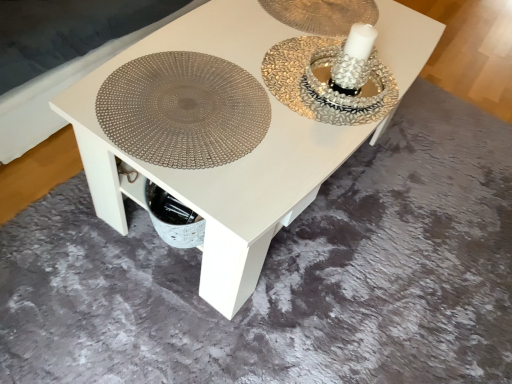
What do you see at coordinates (183, 110) in the screenshot? I see `matte silver platter at center` at bounding box center [183, 110].

At what (x,y) coordinates should I click in order to perform the action: click on matte silver platter at center. Please return your answer as a coordinate pair (x, y). Looking at the image, I should click on (183, 110).

Measure the distance between white glossy table at center and camera.

white glossy table at center and camera are 81.70 centimeters apart from each other.

Find the location of a particular element. white glossy table at center is located at coordinates (225, 165).

This screenshot has width=512, height=384. What do you see at coordinates (225, 165) in the screenshot? I see `white glossy table at center` at bounding box center [225, 165].

The width and height of the screenshot is (512, 384). Identify the location of matte silver platter at center. (183, 110).

Can you confirm if matte silver platter at center is positioned to the left of white glossy table at center?

Yes.

Is matte silver platter at center positioned behind white glossy table at center?

Yes, the depth of matte silver platter at center is greater than that of white glossy table at center.

Considering the points (231, 145) and (97, 130), which point is in front, point (231, 145) or point (97, 130)?

Positioned in front is point (97, 130).

From the image's perspective, which is below, matte silver platter at center or white glossy table at center?

matte silver platter at center is shown below in the image.

From the picture: From a real-world perspective, is matte silver platter at center below white glossy table at center?

Actually, matte silver platter at center is physically above white glossy table at center in the real world.

Is matte silver platter at center wider than white glossy table at center?

No, matte silver platter at center is not wider than white glossy table at center.

Can you confirm if matte silver platter at center is taller than white glossy table at center?

Incorrect, the height of matte silver platter at center is not larger of that of white glossy table at center.

Between matte silver platter at center and white glossy table at center, which one has smaller size?

With smaller size is matte silver platter at center.

Is white glossy table at center a part of matte silver platter at center?

No.

Is matte silver platter at center with white glossy table at center?

No, matte silver platter at center is not in contact with white glossy table at center.

Could you tell me if matte silver platter at center is facing white glossy table at center?

Yes, matte silver platter at center is facing white glossy table at center.

In the image, there is a white glossy table at center. At what (x,y) coordinates should I click in order to perform the action: click on platter below it (from the image's perspective). Please return your answer as a coordinate pair (x, y). The height and width of the screenshot is (384, 512). Looking at the image, I should click on (183, 110).

Which object is positioned more to the right, white glossy table at center or matte silver platter at center?

Positioned to the right is white glossy table at center.

Is white glossy table at center positioned in front of matte silver platter at center?

Yes, white glossy table at center is closer to the camera.

Between point (132, 158) and point (190, 88), which one is positioned in front?

The point (132, 158) is in front.

From the image's perspective, between white glossy table at center and matte silver platter at center, who is located below?

From the image's view, matte silver platter at center is below.

From a real-world perspective, which object stands above the other?

In real-world perspective, matte silver platter at center is above.

Can you confirm if white glossy table at center is thinner than matte silver platter at center?

In fact, white glossy table at center might be wider than matte silver platter at center.

Which of these two, white glossy table at center or matte silver platter at center, stands shorter?

matte silver platter at center.

Can you confirm if white glossy table at center is smaller than matte silver platter at center?

No, white glossy table at center is not smaller than matte silver platter at center.

Is white glossy table at center completely or partially outside of matte silver platter at center?

Yes, white glossy table at center is located beyond the bounds of matte silver platter at center.

Is white glossy table at center touching matte silver platter at center?

No, white glossy table at center is not in contact with matte silver platter at center.

Is white glossy table at center looking in the opposite direction of matte silver platter at center?

white glossy table at center is not turned away from matte silver platter at center.

How many degrees apart are the facing directions of white glossy table at center and matte silver platter at center?

The angular difference between white glossy table at center and matte silver platter at center is 0.000398 degrees.

Where is `table that is on the right side of matte silver platter at center`? This screenshot has height=384, width=512. table that is on the right side of matte silver platter at center is located at coordinates (225, 165).

In the image, there is a matte silver platter at center. What are the coordinates of `table below it (from a real-world perspective)` in the screenshot? It's located at (225, 165).

You are a GUI agent. You are given a task and a screenshot of the screen. Output one action in this format:
    pyautogui.click(x=<x>, y=<y>)
    Task: Click on the platter that is above the white glossy table at center (from a real-world perspective)
    Image resolution: width=512 pixels, height=384 pixels.
    Given the screenshot: What is the action you would take?
    [183, 110]